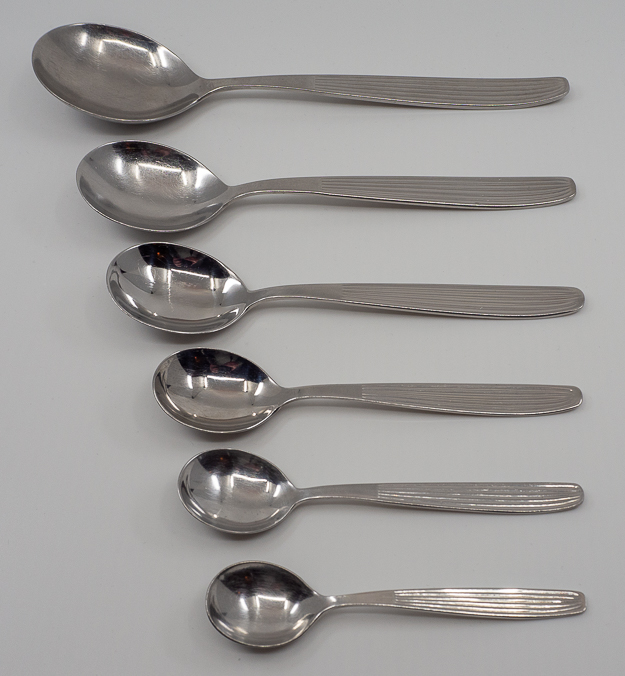
Where is `spoon handles`? This screenshot has width=625, height=676. spoon handles is located at coordinates (470, 604), (480, 493), (490, 393), (459, 285), (446, 199), (448, 84).